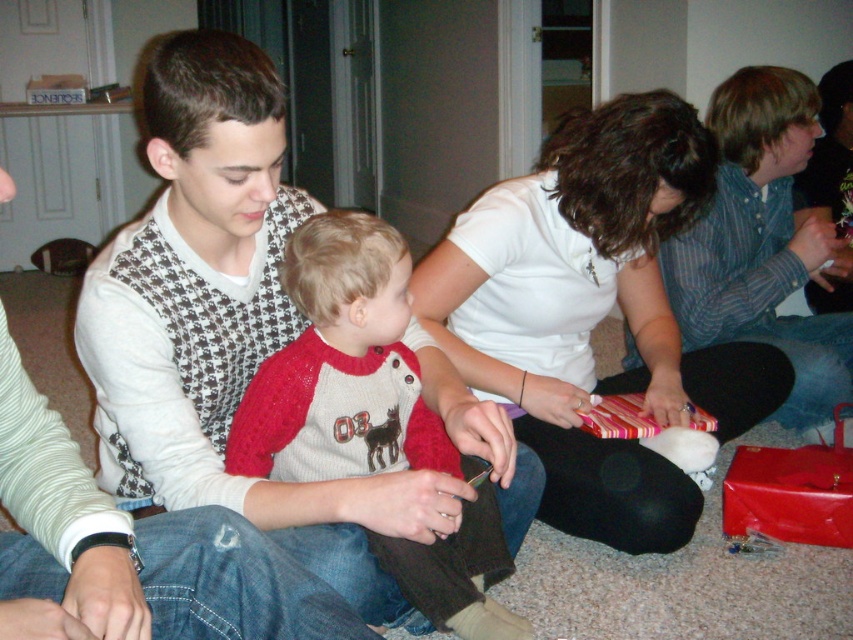
Question: Which of the following is the farthest from the observer?

Choices:
 (A) (265, 474)
 (B) (305, 573)
 (C) (514, 321)

Answer: (C)

Question: Which point is closer to the camera?

Choices:
 (A) (440, 561)
 (B) (566, 346)
 (C) (215, 579)

Answer: (C)

Question: Does white matte shirt at center have a smaller size compared to white sweater vest at center?

Choices:
 (A) no
 (B) yes

Answer: (A)

Question: From the image, what is the correct spatial relationship of red knit sweater at center in relation to white sweater vest at center?

Choices:
 (A) right
 (B) left

Answer: (A)

Question: Is white matte shirt at center to the right of red knit sweater at center from the viewer's perspective?

Choices:
 (A) yes
 (B) no

Answer: (A)

Question: Estimate the real-world distances between objects in this image. Which object is closer to the white matte shirt at center?

Choices:
 (A) white sweater vest at center
 (B) red knit sweater at center

Answer: (B)